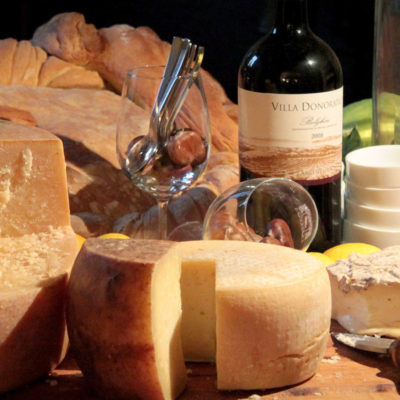
You are a GUI agent. You are given a task and a screenshot of the screen. Output one action in this format:
    pyautogui.click(x=<x>, y=<y>)
    Task: Click on the glass
    Image resolution: width=400 pixels, height=400 pixels.
    Given the screenshot: What is the action you would take?
    pyautogui.click(x=243, y=225)